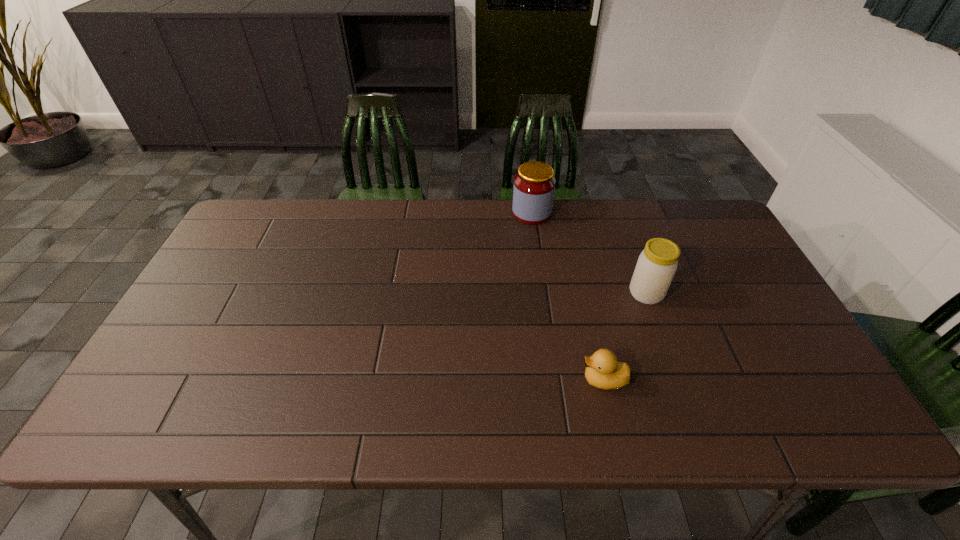
I want to click on the farthest object, so click(x=534, y=185).

Find the location of a particular element. This screenshot has height=540, width=960. the left jar is located at coordinates (534, 185).

Locate an element on the screen. the right jar is located at coordinates (657, 264).

The width and height of the screenshot is (960, 540). I want to click on the nearer jar, so click(657, 264).

Identify the location of duckling. This screenshot has height=540, width=960. (603, 370).

I want to click on the nearest object, so click(603, 370).

This screenshot has height=540, width=960. I want to click on vacant region located 0.290m on the right of the left jar, so click(638, 213).

At what (x,y) coordinates should I click in order to perform the action: click on vacant space located 0.050m on the front of the rightmost object. Please return your answer as a coordinate pair (x, y). Looking at the image, I should click on (656, 321).

The width and height of the screenshot is (960, 540). I want to click on vacant area located on the face of the shortest object, so click(x=506, y=380).

Locate an element on the screen. The width and height of the screenshot is (960, 540). vacant space situated on the face of the shortest object is located at coordinates (493, 380).